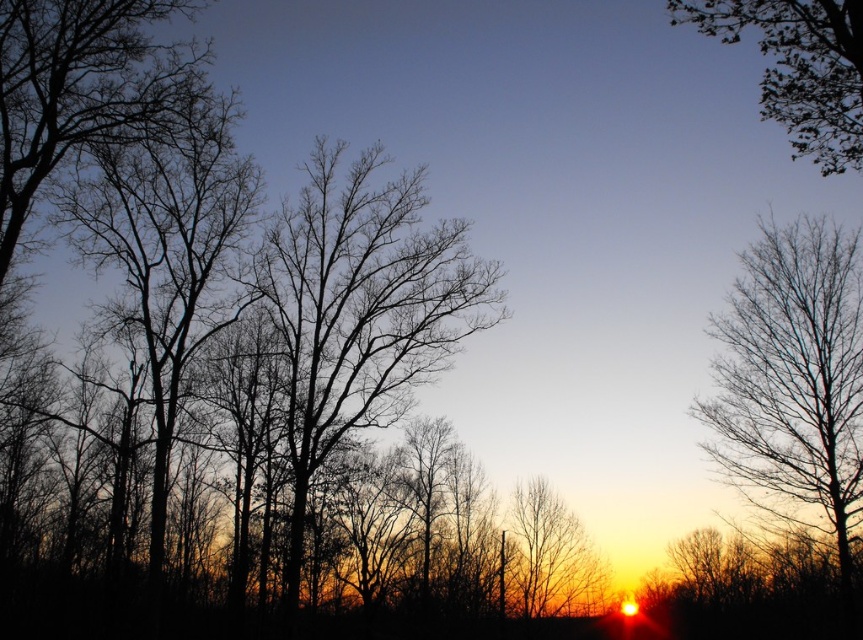
Which is behind, point (786, 84) or point (569, 525)?

The point (569, 525) is more distant.

Which of these two, green leafy tree at upper right or smooth bark tree at center, stands taller?

green leafy tree at upper right

Is point (830, 13) farther from viewer compared to point (572, 516)?

No, it is not.

Locate an element on the screen. The height and width of the screenshot is (640, 863). green leafy tree at upper right is located at coordinates (799, 68).

Is black bare tree at center shorter than bare branches at left?

In fact, black bare tree at center may be taller than bare branches at left.

At what (x,y) coordinates should I click in order to perform the action: click on black bare tree at center. Please return your answer as a coordinate pair (x, y). Looking at the image, I should click on (361, 307).

Identify the location of black bare tree at center. This screenshot has height=640, width=863. (361, 307).

Can you confirm if bare branches at left is positioned to the right of smooth bark tree at center?

Incorrect, bare branches at left is not on the right side of smooth bark tree at center.

Does bare branches at left have a lesser height compared to smooth bark tree at center?

In fact, bare branches at left may be taller than smooth bark tree at center.

What do you see at coordinates (79, 88) in the screenshot?
I see `bare branches at left` at bounding box center [79, 88].

Where is `bare branches at left`? This screenshot has width=863, height=640. bare branches at left is located at coordinates (79, 88).